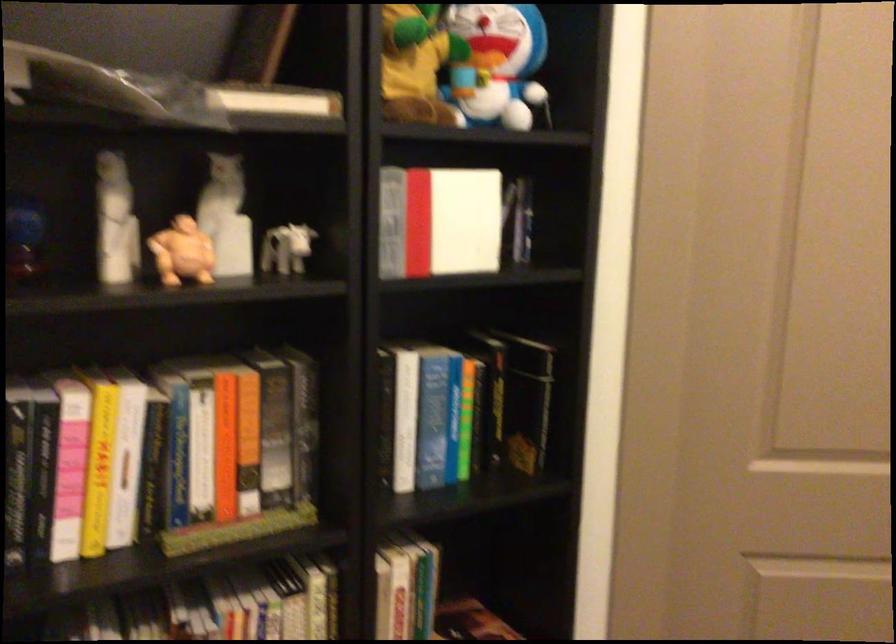
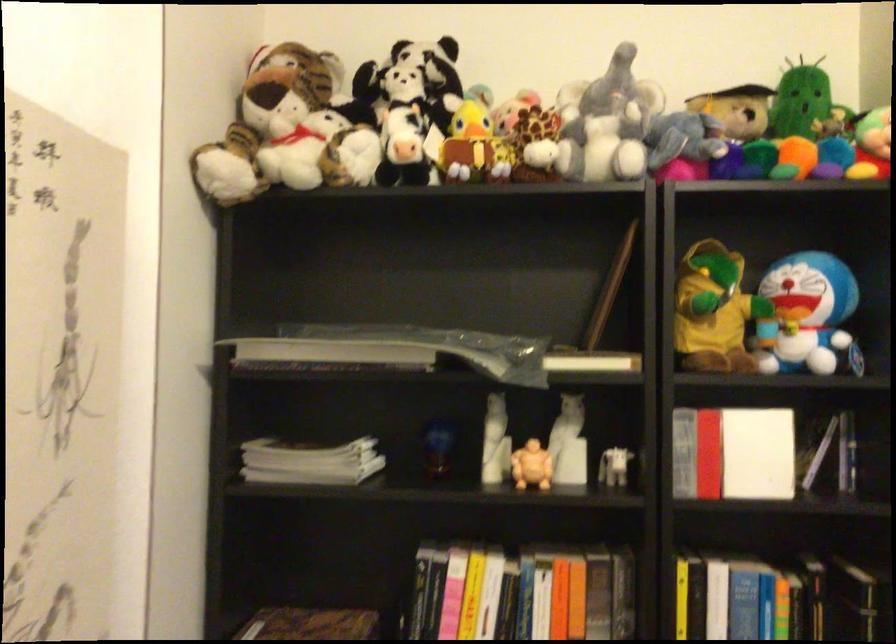
In the second image, find the point that corresponds to (x=227, y=176) in the first image.

(572, 409)